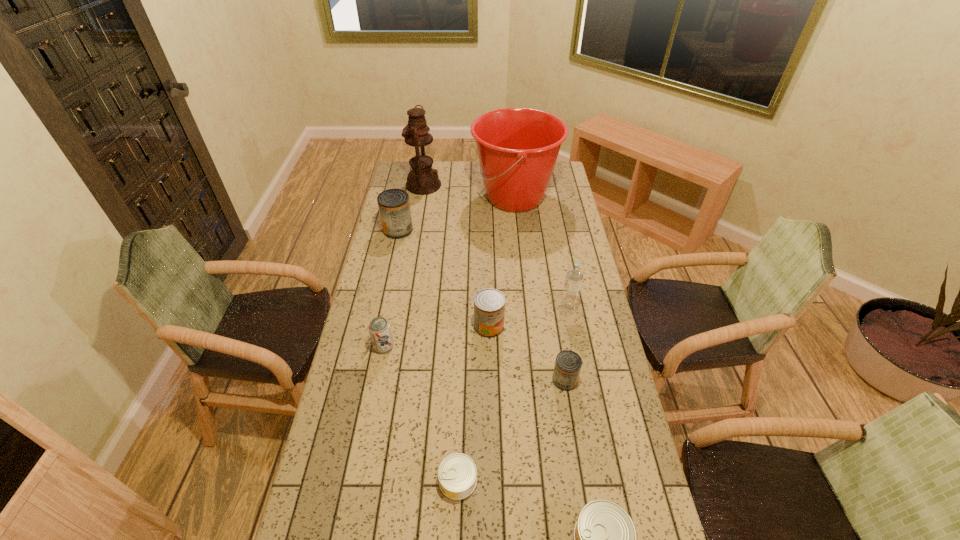
Point out which red can is positioned as the second nearest to the shortest object. Please provide its 2D coordinates. Your answer should be formatted as a tuple, i.e. [(x, y)], where the tuple contains the x and y coordinates of a point satisfying the conditions above.

[(489, 304)]

Locate an element on the screen. vacant position in the image that satisfies the following two spatial constraints: 1. with the handle attached to the rim of the red bucket; 2. on the left side of the water bottle is located at coordinates (526, 309).